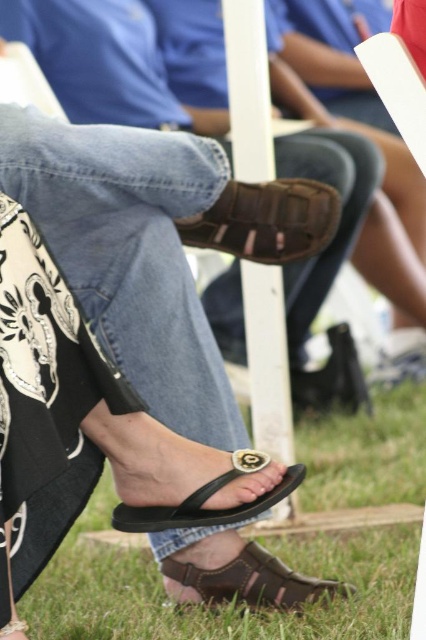
Question: Estimate the real-world distances between objects in this image. Which object is closer to the black rubber sandal at lower center?

Choices:
 (A) brown leather sandal at lower center
 (B) brown leather sandal at center
 (C) green grass at lower center
 (D) black leather sandal at lower center

Answer: (A)

Question: In this image, where is green grass at lower center located relative to brown leather sandal at center?

Choices:
 (A) below
 (B) above

Answer: (A)

Question: Which object appears farthest from the camera in this image?

Choices:
 (A) brown leather sandal at lower center
 (B) black leather sandal at lower center

Answer: (A)

Question: Considering the real-world distances, which object is farthest from the brown leather sandal at center?

Choices:
 (A) black rubber sandal at lower center
 (B) black leather sandal at lower center
 (C) brown leather sandal at lower center
 (D) green grass at lower center

Answer: (B)

Question: Can you confirm if black rubber sandal at lower center is positioned to the left of black leather sandal at lower center?

Choices:
 (A) no
 (B) yes

Answer: (A)

Question: Is brown leather sandal at center smaller than black rubber sandal at lower center?

Choices:
 (A) yes
 (B) no

Answer: (B)